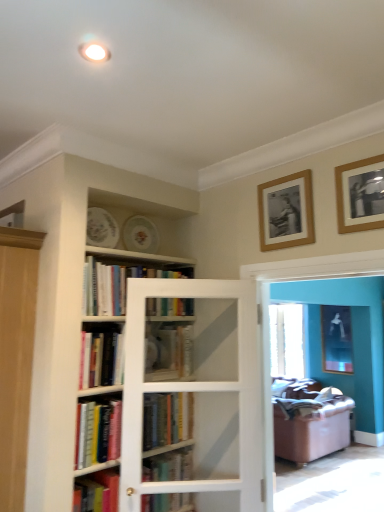
Question: From the image's perspective, is hardcover books at center, acting as the 2th book starting from the top, above hardcover book at center, the 2th book positioned from the bottom?

Choices:
 (A) yes
 (B) no

Answer: (A)

Question: Is hardcover books at center, acting as the 2th book starting from the top, taller than hardcover book at center, the 2th book positioned from the bottom?

Choices:
 (A) yes
 (B) no

Answer: (A)

Question: Is hardcover books at center, acting as the 2th book starting from the top, further to the viewer compared to hardcover book at center, the 2th book positioned from the bottom?

Choices:
 (A) yes
 (B) no

Answer: (B)

Question: From a real-world perspective, is hardcover books at center, placed as the fifth book when sorted from bottom to top, physically below hardcover book at center, the 2th book positioned from the bottom?

Choices:
 (A) yes
 (B) no

Answer: (B)

Question: Considering the relative sizes of hardcover books at center, placed as the fifth book when sorted from bottom to top, and hardcover book at center, the 2th book positioned from the bottom, in the image provided, is hardcover books at center, placed as the fifth book when sorted from bottom to top, thinner than hardcover book at center, the 2th book positioned from the bottom,?

Choices:
 (A) yes
 (B) no

Answer: (B)

Question: Is hardcover books at center, acting as the 2th book starting from the top, to the right of hardcover book at center, the 2th book positioned from the bottom, from the viewer's perspective?

Choices:
 (A) yes
 (B) no

Answer: (B)

Question: Is matte glass screen door at center, marked as the 1th screen door in a right-to-left arrangement, wider than hardcover book at center, which is the 5th book from top to bottom?

Choices:
 (A) no
 (B) yes

Answer: (A)

Question: Is matte glass screen door at center, marked as the 1th screen door in a right-to-left arrangement, taller than hardcover book at center, which is the 5th book from top to bottom?

Choices:
 (A) yes
 (B) no

Answer: (A)

Question: Is matte glass screen door at center, marked as the second screen door in a left-to-right arrangement, positioned beyond the bounds of hardcover book at center, the 2th book positioned from the bottom?

Choices:
 (A) yes
 (B) no

Answer: (A)

Question: Can you confirm if matte glass screen door at center, marked as the 1th screen door in a right-to-left arrangement, is smaller than hardcover book at center, which is the 5th book from top to bottom?

Choices:
 (A) yes
 (B) no

Answer: (B)

Question: Is matte glass screen door at center, marked as the 1th screen door in a right-to-left arrangement, at the right side of hardcover book at center, the 2th book positioned from the bottom?

Choices:
 (A) no
 (B) yes

Answer: (B)

Question: Is matte glass screen door at center, marked as the second screen door in a left-to-right arrangement, facing away from hardcover book at center, the 2th book positioned from the bottom?

Choices:
 (A) no
 (B) yes

Answer: (A)

Question: Is hardcover books at upper center, which is counted as the sixth book, starting from the bottom, bigger than hardcover book at center, which is counted as the first book, starting from the bottom?

Choices:
 (A) yes
 (B) no

Answer: (A)